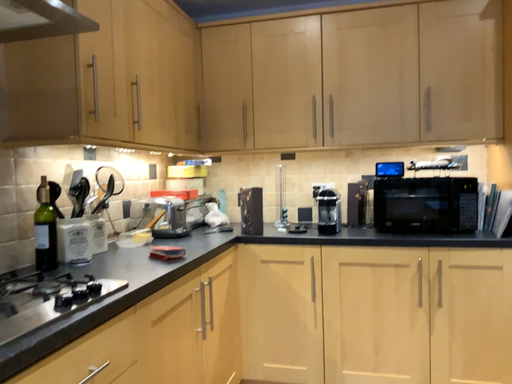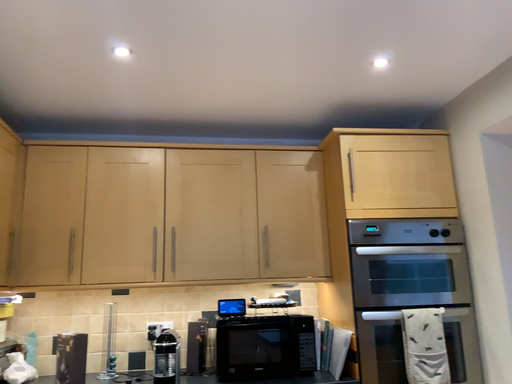
Question: Which way did the camera rotate in the video?

Choices:
 (A) rotated right
 (B) rotated left

Answer: (A)